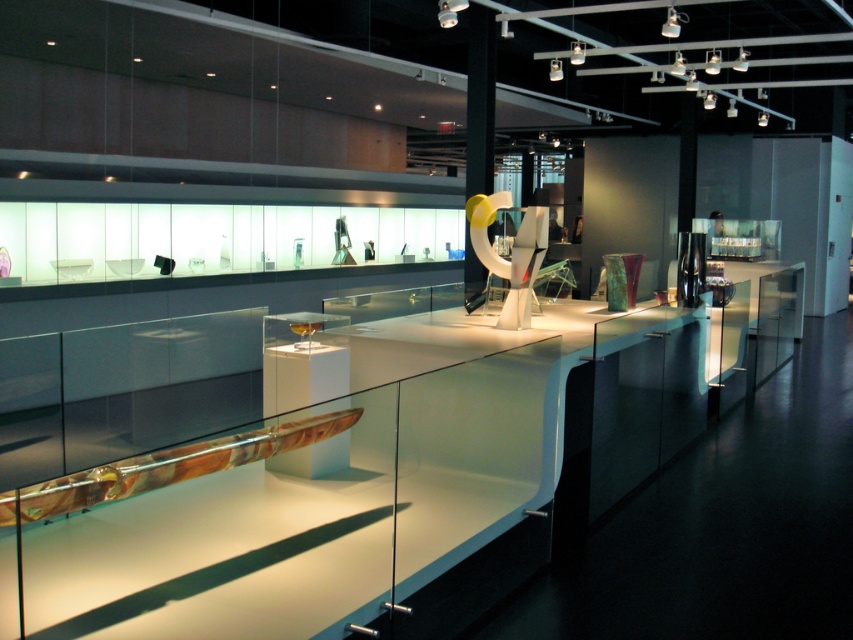
You are an art curator planning to place a new sculpture on the white glossy counter top at center. The sculpture requires a minimum of 0.5 meters of space around it to ensure safety and visibility. Given the coordinates of the counter top, can you confirm if there is sufficient space available around it for the sculpture?

The white glossy counter top at center is positioned at point (363, 467). However, without knowing the dimensions of the counter top or the surrounding area, it is impossible to determine if there is enough space for the sculpture. Additional measurements are needed.

You are an art curator planning to install a new light fixture above the white glossy counter top at center and the translucent glass sculpture at center. Based on their positions, where should the light fixture be placed to illuminate both objects effectively?

The light fixture should be placed above the white glossy counter top at center since it is located below the translucent glass sculpture at center, allowing the light to reach both objects effectively.

You are an art curator planning to move a 40 inch wide sculpture into the space between the white glossy counter top at center and the translucent glass sculpture at center. Based on the available space, will the sculpture fit between them?

The distance between the white glossy counter top at center and the translucent glass sculpture at center is 38.87 inches. Since the sculpture is 40 inches wide, it will not fit as the space is narrower than the sculpture.